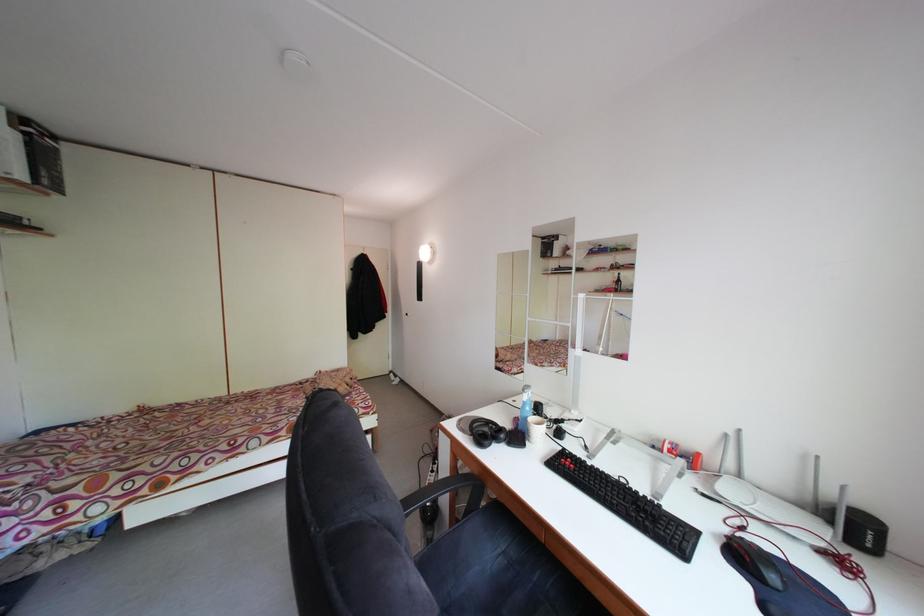
The width and height of the screenshot is (924, 616). Describe the element at coordinates (755, 562) in the screenshot. I see `a black computer mouse` at that location.